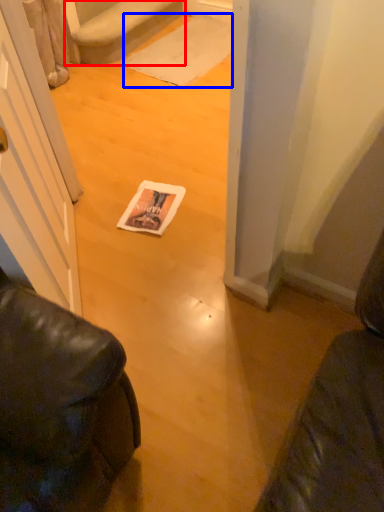
Question: Which object appears farthest to the camera in this image, stairwell (highlighted by a red box) or doormat (highlighted by a blue box)?

Choices:
 (A) stairwell
 (B) doormat

Answer: (B)